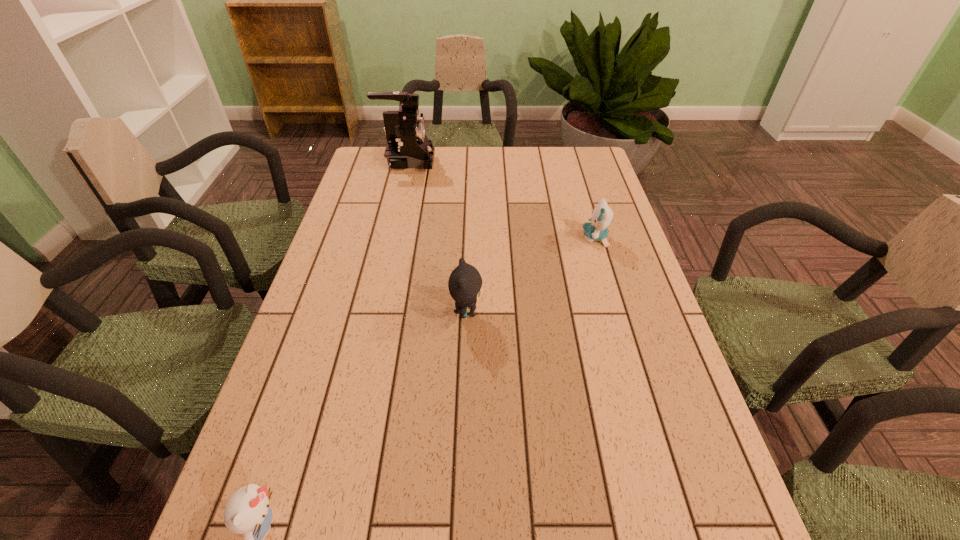
Find the location of a particular element. camcorder is located at coordinates (407, 146).

You are a GUI agent. You are given a task and a screenshot of the screen. Output one action in this format:
    pyautogui.click(x=<x>, y=<y>)
    Task: Click on the tallest object
    
    Given the screenshot: What is the action you would take?
    pyautogui.click(x=407, y=146)

You are a GUI agent. You are given a task and a screenshot of the screen. Output one action in this format:
    pyautogui.click(x=<x>, y=<y>)
    Task: Click on the tallest kitten
    The height and width of the screenshot is (540, 960).
    Given the screenshot: What is the action you would take?
    pyautogui.click(x=465, y=282)

Where is `the second farthest kitten`? The width and height of the screenshot is (960, 540). the second farthest kitten is located at coordinates (465, 282).

Where is `the farthest kitten`? Image resolution: width=960 pixels, height=540 pixels. the farthest kitten is located at coordinates (596, 230).

Locate an element on the screen. This screenshot has width=960, height=540. the rightmost kitten is located at coordinates (596, 230).

The image size is (960, 540). In order to click on blank space located 0.200m on the lens mount of the tallest object in this screenshot , I will do `click(492, 161)`.

I want to click on vacant space positioned on the front-facing side of the second farthest kitten, so click(x=549, y=312).

I want to click on free space located on the face of the rightmost object, so click(x=551, y=238).

This screenshot has width=960, height=540. Find the location of `vacant point located on the face of the rightmost object`. vacant point located on the face of the rightmost object is located at coordinates (516, 238).